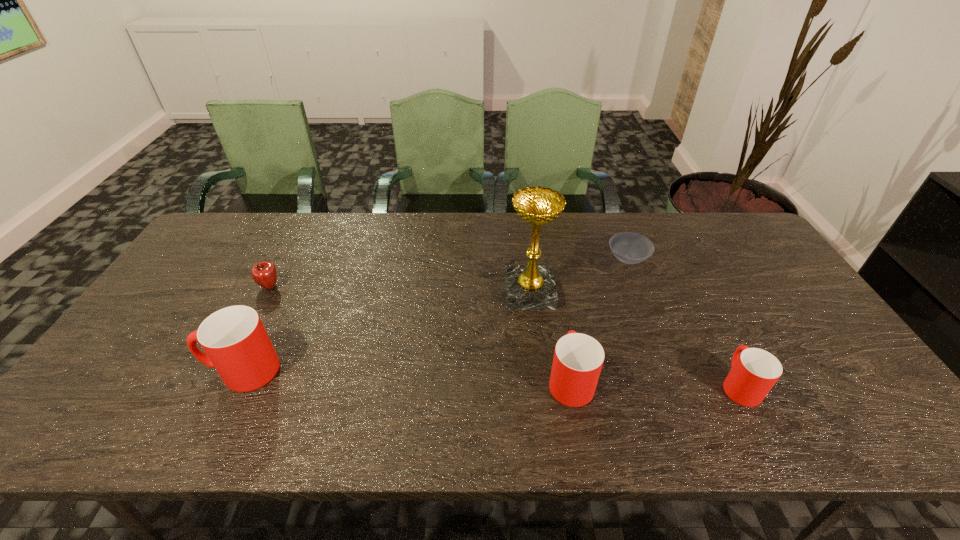
Locate which cup ranks second in proximity to the award. Please provide its 2D coordinates. Your answer should be formatted as a tuple, i.e. [(x, y)], where the tuple contains the x and y coordinates of a point satisfying the conditions above.

[(754, 372)]

Select which cup is the closest to the second shortest object. Please provide its 2D coordinates. Your answer should be formatted as a tuple, i.e. [(x, y)], where the tuple contains the x and y coordinates of a point satisfying the conditions above.

[(236, 344)]

Image resolution: width=960 pixels, height=540 pixels. Find the location of `blank space that satisfies the following two spatial constraints: 1. on the side of the second shortest cup with the handle; 2. on the right side of the bowl`. blank space that satisfies the following two spatial constraints: 1. on the side of the second shortest cup with the handle; 2. on the right side of the bowl is located at coordinates coord(548,259).

At what (x,y) coordinates should I click in order to perform the action: click on vacant area in the image that satisfies the following two spatial constraints: 1. on the side of the farthest object with the handle; 2. on the left side of the tallest cup. Please return your answer as a coordinate pair (x, y). The height and width of the screenshot is (540, 960). Looking at the image, I should click on (296, 259).

Where is `vacant space that satisfies the following two spatial constraints: 1. on the side of the second tallest cup with the handle; 2. on the front-facing side of the award`? vacant space that satisfies the following two spatial constraints: 1. on the side of the second tallest cup with the handle; 2. on the front-facing side of the award is located at coordinates (554, 293).

The height and width of the screenshot is (540, 960). In order to click on free space that satisfies the following two spatial constraints: 1. on the side of the second cup from right to left with the handle; 2. on the front-facing side of the tallest object in this screenshot , I will do `click(554, 293)`.

The height and width of the screenshot is (540, 960). I want to click on vacant space that satisfies the following two spatial constraints: 1. on the front-facing side of the award; 2. on the side of the rightmost cup with the handle, so click(x=540, y=385).